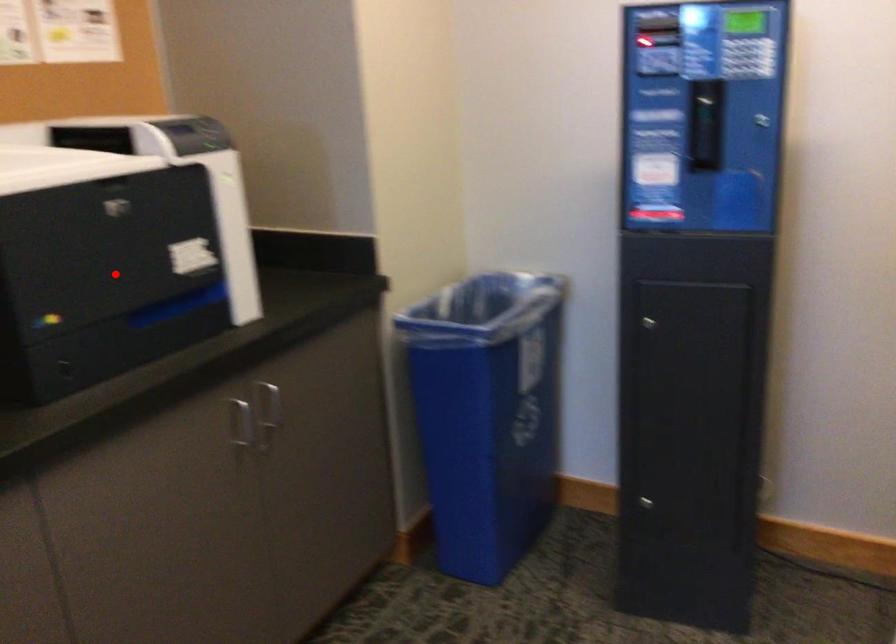
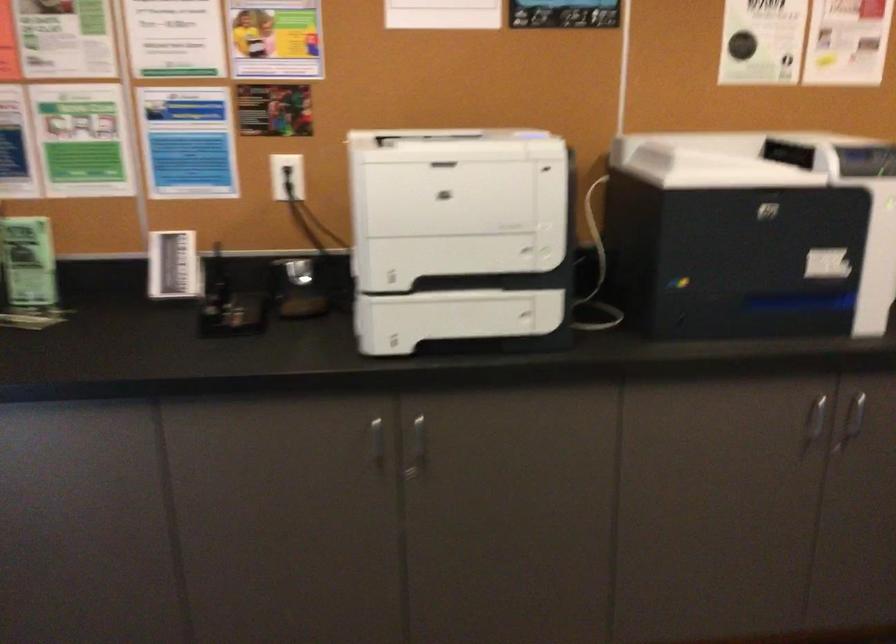
In the second image, find the point that corresponds to the highlighted location in the first image.

(737, 259)